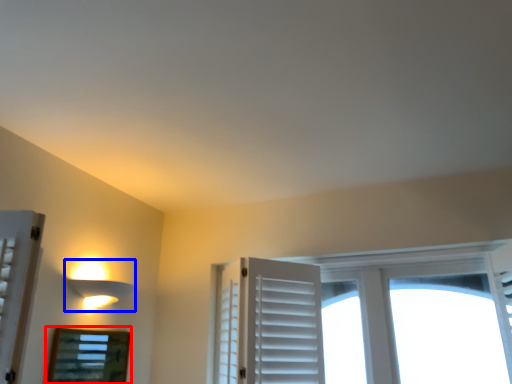
Question: Which of the following is the closest to the observer, bay window (highlighted by a red box) or lamp (highlighted by a blue box)?

Choices:
 (A) bay window
 (B) lamp

Answer: (A)